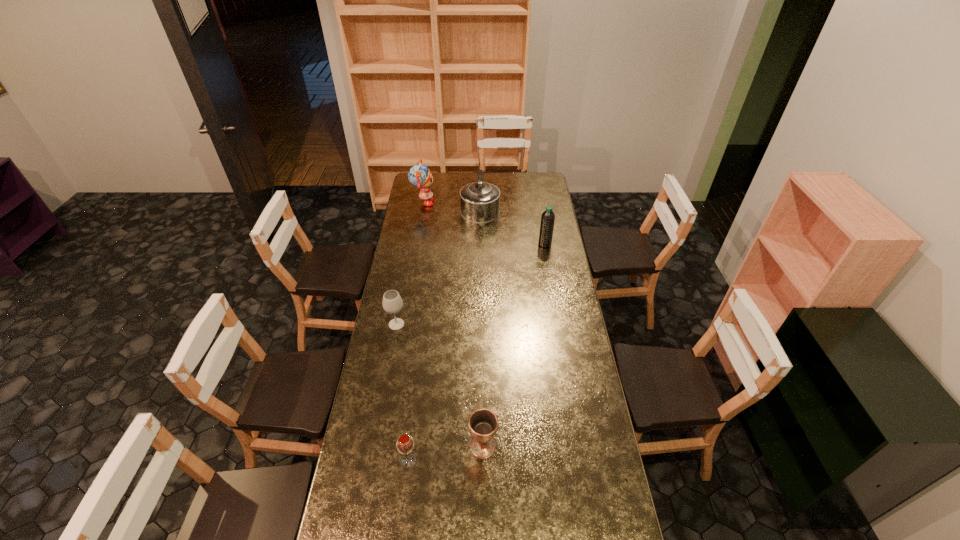
Find the location of `blank area at the far right corner`. blank area at the far right corner is located at coordinates (547, 178).

Locate an element on the screen. vacant space that's between the right wineglass and the kettle is located at coordinates (444, 338).

The height and width of the screenshot is (540, 960). I want to click on free spot between the right wineglass and the fourth nearest object, so point(477,353).

This screenshot has width=960, height=540. What are the coordinates of `vacant space that's between the doll and the nearer wineglass` in the screenshot? It's located at (416, 332).

Identify the location of vacant area that lies between the shorter wineglass and the kettle. (444, 338).

You are a GUI agent. You are given a task and a screenshot of the screen. Output one action in this format:
    pyautogui.click(x=<x>, y=<y>)
    Task: Click on the vacant space in between the doll and the chalice
    The height and width of the screenshot is (540, 960).
    Given the screenshot: What is the action you would take?
    pyautogui.click(x=453, y=325)

Locate an element on the screen. This screenshot has width=960, height=540. free space between the right wineglass and the taller wineglass is located at coordinates (403, 393).

Where is `unoccupied position between the doll and the water bottle`? The width and height of the screenshot is (960, 540). unoccupied position between the doll and the water bottle is located at coordinates (484, 224).

This screenshot has height=540, width=960. Find the location of `free space between the chalice and the third nearest object`. free space between the chalice and the third nearest object is located at coordinates pyautogui.click(x=440, y=385).

Identify the location of vacant region between the rightmost object and the doll. (484, 224).